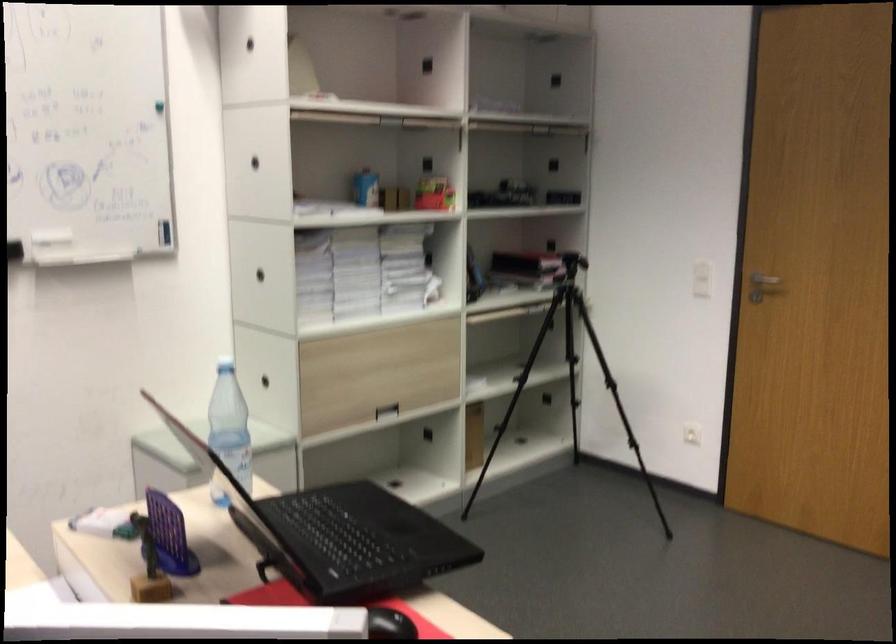
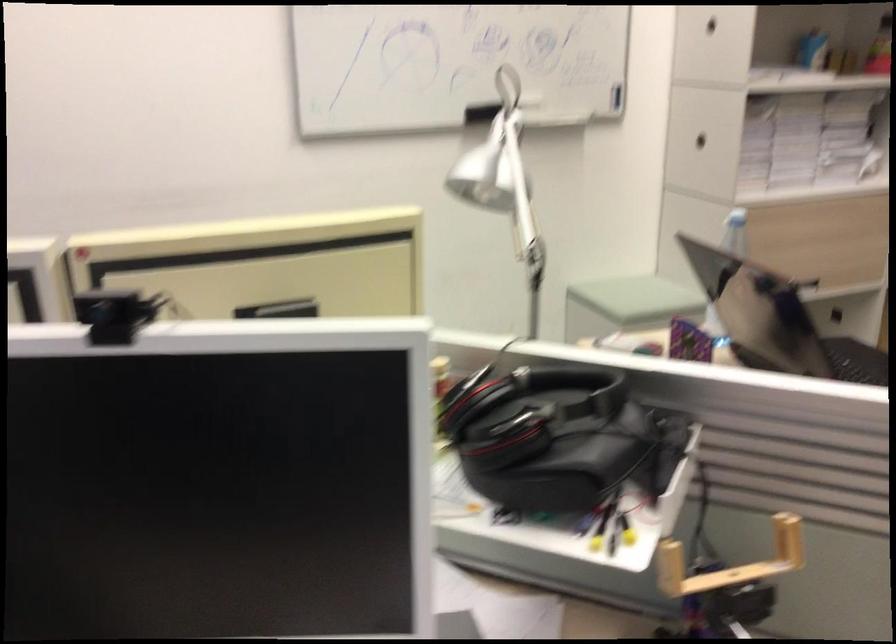
Where in the second image is the point corresponding to pixel 255 278 from the first image?

(700, 140)